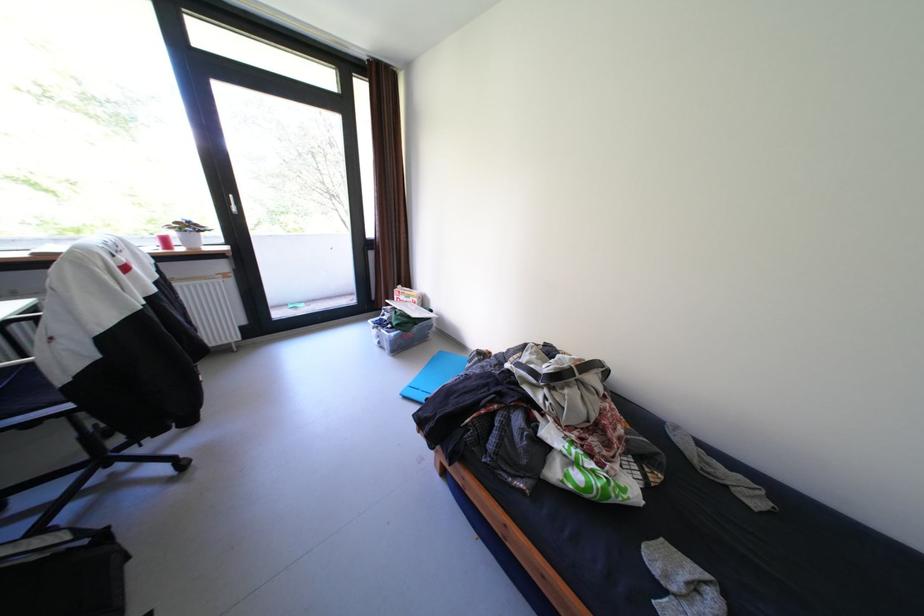
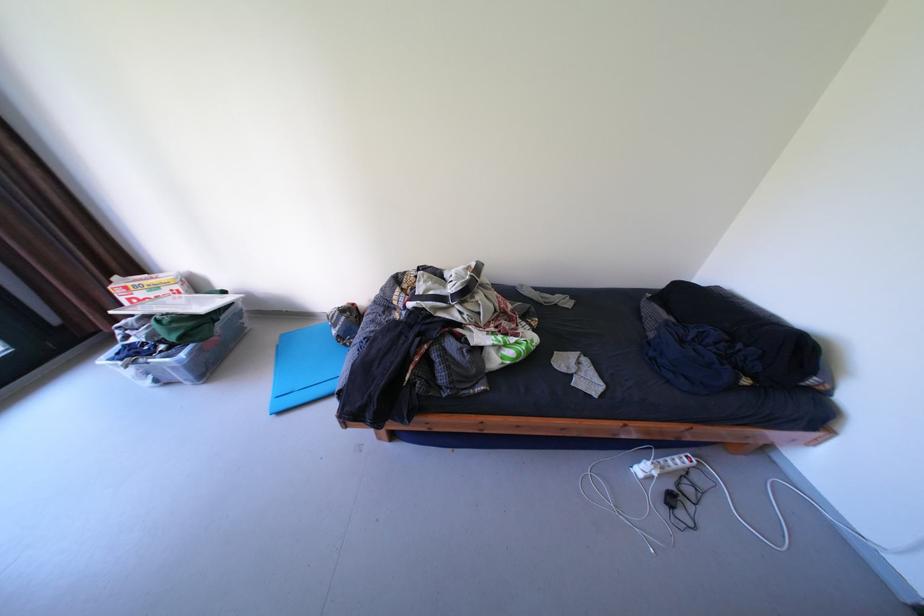
Based on the continuous images, in which direction is the camera rotating?

The rotation direction of the camera is right-down.